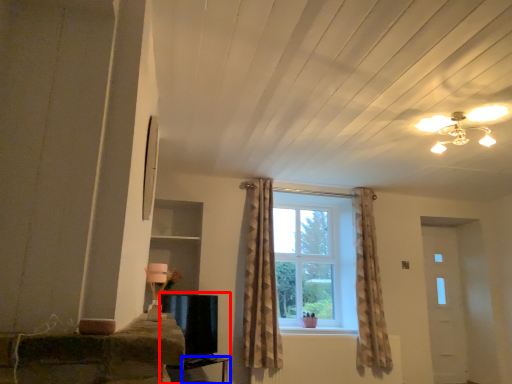
Question: Which object appears closest to the camera in this image, entertainment center (highlighted by a red box) or table (highlighted by a blue box)?

Choices:
 (A) entertainment center
 (B) table

Answer: (B)